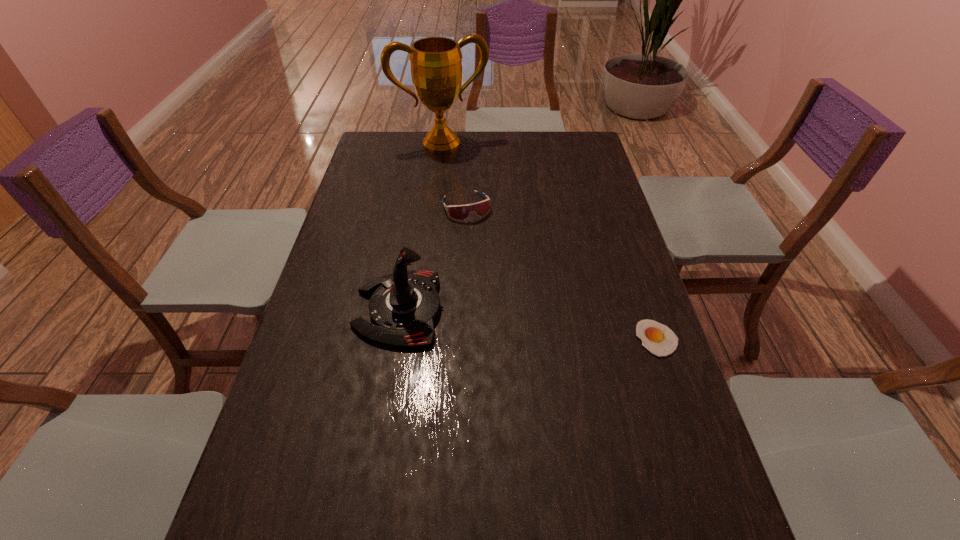
Where is `vacant region at the far edge`? The image size is (960, 540). vacant region at the far edge is located at coordinates (462, 144).

Locate an element on the screen. Image resolution: width=960 pixels, height=540 pixels. free space at the left edge of the desktop is located at coordinates (335, 427).

In the image, there is a desktop. Where is `vacant space at the right edge`? This screenshot has width=960, height=540. vacant space at the right edge is located at coordinates (593, 259).

Identify the location of vacant space at the far left corner. (409, 141).

The width and height of the screenshot is (960, 540). Identify the location of empty location between the joystick and the third tallest object. (433, 258).

Where is `free spot between the third shortest object and the shortest object`? The height and width of the screenshot is (540, 960). free spot between the third shortest object and the shortest object is located at coordinates (528, 324).

The width and height of the screenshot is (960, 540). I want to click on free space between the joystick and the award, so point(420,227).

Identify the location of vacant space in between the second tallest object and the egg yolk. coord(528,324).

Identify the location of free space between the third tallest object and the award. (454, 175).

This screenshot has width=960, height=540. I want to click on vacant point located between the tallest object and the egg yolk, so click(549, 241).